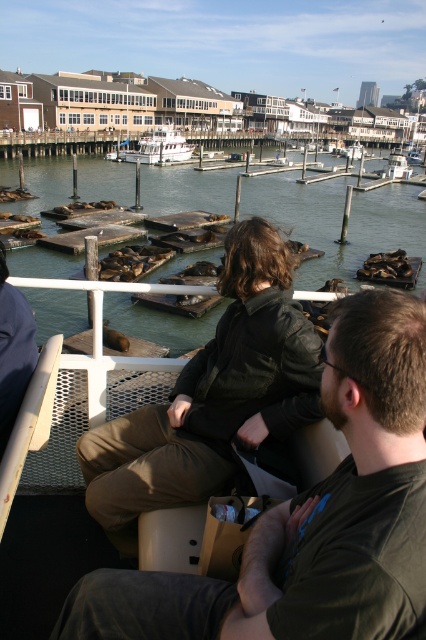
You are standing at the point marked by coordinates point (212, 396) in the waterfront scene. What is the nearest object to you?

The nearest object to you at point (212, 396) is the leather jacket at center.

You are standing on the dock and see the dark brown leather jacket at center and the white matte boat at center. Which object is closer to the water surface?

The dark brown leather jacket at center is below the white matte boat at center, so it is closer to the water surface.